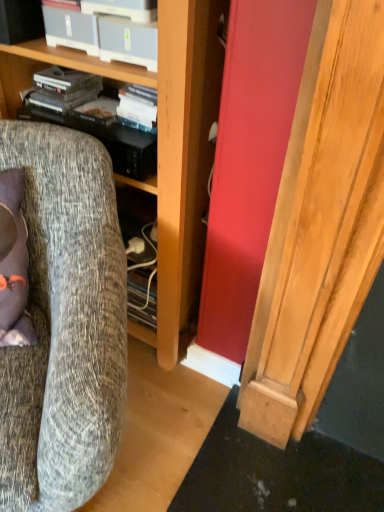
Find the location of `empty space that is ontop of matte black shelf at upper left (from a real-world perspective)`. empty space that is ontop of matte black shelf at upper left (from a real-world perspective) is located at coordinates (100, 116).